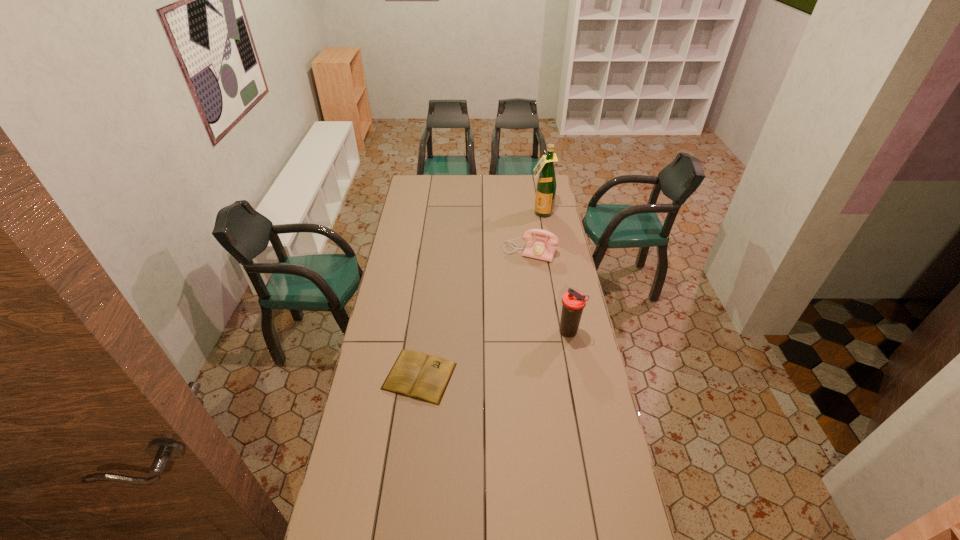
Where is `free space located 0.110m on the dial of the second shortest object`? The height and width of the screenshot is (540, 960). free space located 0.110m on the dial of the second shortest object is located at coordinates (516, 276).

I want to click on free location located on the dial of the second shortest object, so click(x=507, y=299).

Where is `free space located 0.390m on the dial of the second shortest object`? Image resolution: width=960 pixels, height=540 pixels. free space located 0.390m on the dial of the second shortest object is located at coordinates (499, 316).

In order to click on free space located 0.220m on the front-facing side of the liquor in this screenshot , I will do `click(533, 240)`.

You are a GUI agent. You are given a task and a screenshot of the screen. Output one action in this format:
    pyautogui.click(x=<x>, y=<y>)
    Task: Click on the vacant area situated 0.190m on the front-facing side of the liquor
    
    Given the screenshot: What is the action you would take?
    pyautogui.click(x=534, y=237)

You are a GUI agent. You are given a task and a screenshot of the screen. Output one action in this format:
    pyautogui.click(x=<x>, y=<y>)
    Task: Click on the vacant space situated 0.260m on the front-facing side of the liquor
    The width and height of the screenshot is (960, 540).
    Given the screenshot: What is the action you would take?
    tap(532, 245)

Where is `object that is at the left edge`? object that is at the left edge is located at coordinates (414, 374).

This screenshot has width=960, height=540. Find the location of `thermos bottle that is at the right edge`. thermos bottle that is at the right edge is located at coordinates (573, 302).

Find the location of a particular element. This screenshot has width=960, height=540. telephone that is at the right edge is located at coordinates (544, 247).

The height and width of the screenshot is (540, 960). In order to click on liquor at the right edge in this screenshot , I will do `click(546, 185)`.